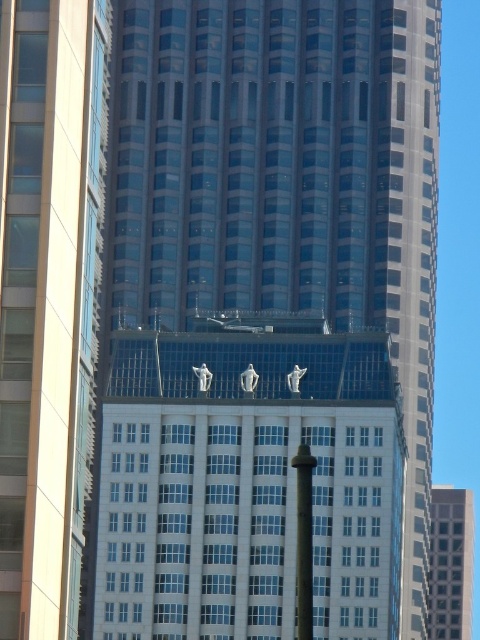
You are a drone operator trying to capture aerial footage of the white glass building at center and the glassy steel skyscraper at center. From your current position, which one would appear closer to you based on their positions in the image?

The white glass building at center appears closer because the glassy steel skyscraper at center is positioned behind it.

You are an urban planner assessing the skyline of this city. You notice the white glass building at center and the glassy reflective skyscraper at center. Which one has a greater height?

The white glass building at center has a greater height compared to the glassy reflective skyscraper at center.